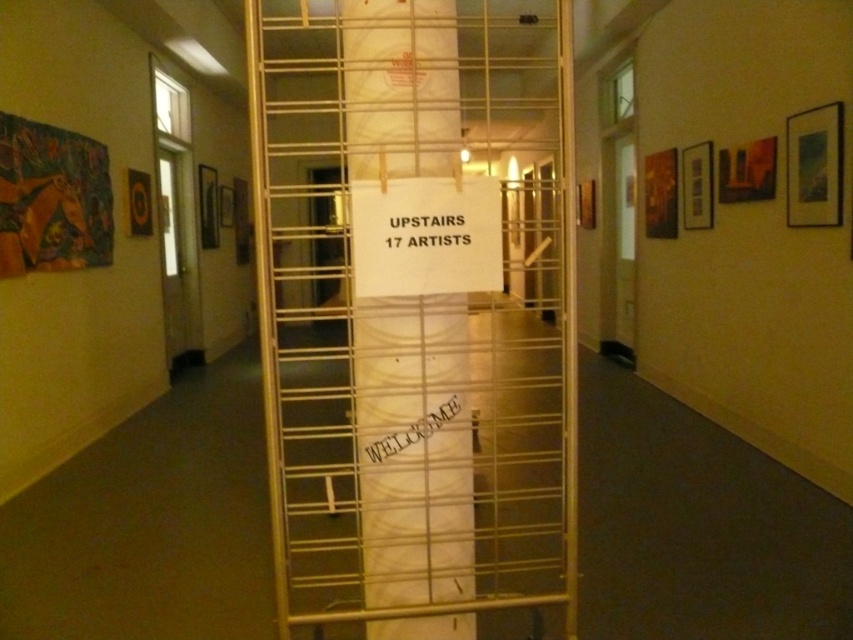
You are an art curator planning to move a new artwork that is 5 meters long into the hallway. The artwork needs to be placed between the gold metal scaffolding at center and the white paper at center. Is there enough space for the artwork to fit between them?

The distance between the gold metal scaffolding at center and the white paper at center is 5.06 meters. Since the artwork is 5 meters long, it will fit with 0.06 meters of space remaining.

You are standing in the hallway and want to reach the point marked by point (x=503, y=512). To do so, you must pass through the area near point (x=387, y=461). Will you be able to move from your current position to the target point without going around the barrier?

Since point (x=503, y=512) is behind point (x=387, y=461), you will need to go around the barrier to reach it because you cannot pass through the barrier directly.

You are an art exhibition visitor and you see the gold metal scaffolding at center and the white paper at center. Which object is positioned to the left from your perspective?

The gold metal scaffolding at center is to the left of the white paper at center.